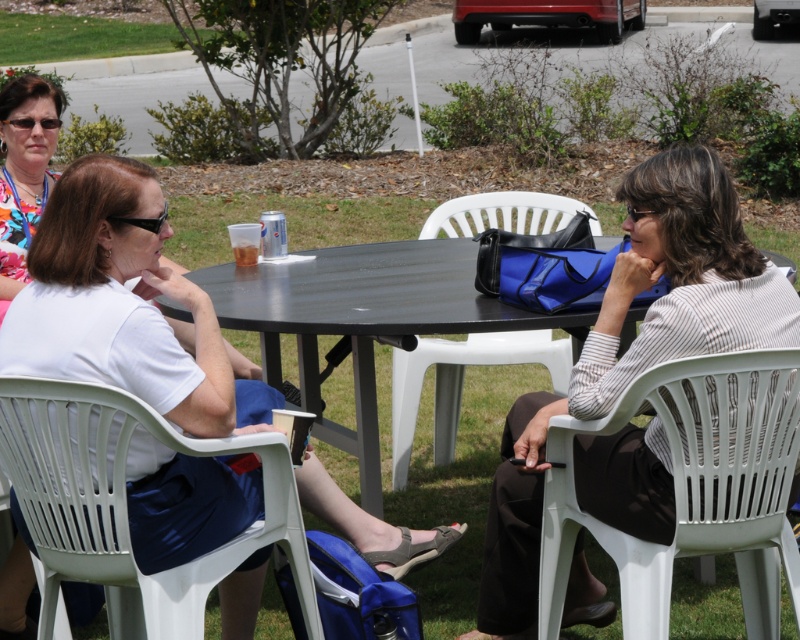
Question: Is white plastic chair at right positioned before white plastic chair at center?

Choices:
 (A) yes
 (B) no

Answer: (A)

Question: Does white matte shirt at left have a smaller size compared to white plastic chair at right?

Choices:
 (A) yes
 (B) no

Answer: (B)

Question: Is the position of white matte shirt at left more distant than that of striped fabric shirt at center?

Choices:
 (A) yes
 (B) no

Answer: (B)

Question: Which of the following is the farthest from the observer?

Choices:
 (A) (178, 582)
 (B) (760, 369)
 (C) (613, 508)

Answer: (C)

Question: Which point appears closest to the camera in this image?

Choices:
 (A) (640, 241)
 (B) (38, 339)

Answer: (B)

Question: Which object is the farthest from the translucent plastic cup at center?

Choices:
 (A) white plastic chair at right
 (B) white plastic chair at center
 (C) striped fabric shirt at center
 (D) white plastic chair at lower left

Answer: (A)